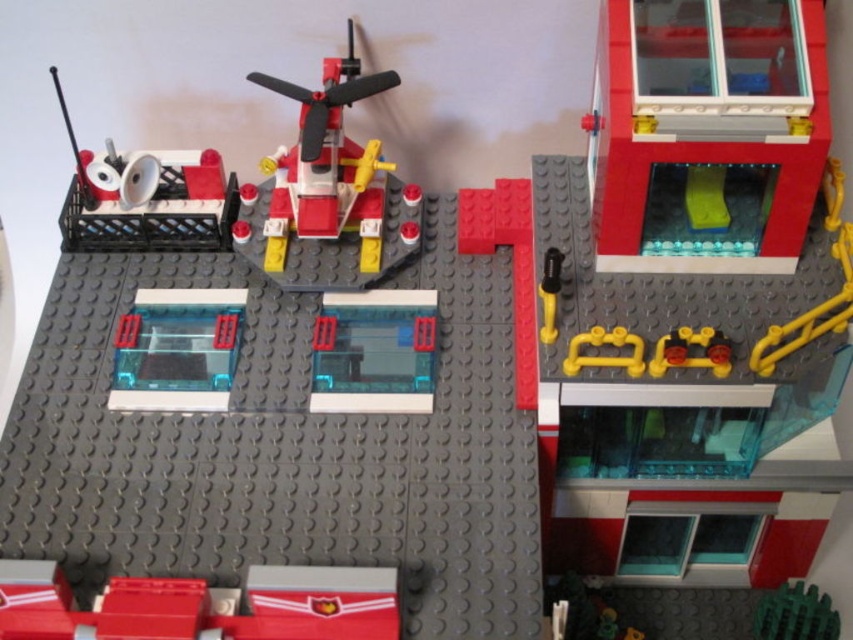
Does matte black speaker at upper left have a lesser width compared to transparent plastic window at center?

No, matte black speaker at upper left is not thinner than transparent plastic window at center.

Does point (109, 150) lie in front of point (425, 355)?

No.

Who is more distant from viewer, (180, 164) or (366, 307)?

Point (180, 164)

Locate an element on the screen. matte black speaker at upper left is located at coordinates (146, 196).

Between transparent plastic window at center and green rubber ball at lower right, which one has less height?

green rubber ball at lower right is shorter.

Is transparent plastic window at center above green rubber ball at lower right?

Yes, transparent plastic window at center is above green rubber ball at lower right.

Between point (404, 358) and point (804, 593), which one is positioned behind?

The point (804, 593) is behind.

Find the location of a particular element. transparent plastic window at center is located at coordinates (374, 352).

Is transparent plastic window at upper right taller than transparent plastic window at lower left?

Yes, transparent plastic window at upper right is taller than transparent plastic window at lower left.

The height and width of the screenshot is (640, 853). What do you see at coordinates (706, 122) in the screenshot?
I see `transparent plastic window at upper right` at bounding box center [706, 122].

Is point (770, 157) more distant than point (172, 289)?

No, it is in front of (172, 289).

Identify the location of transparent plastic window at upper right. The image size is (853, 640). (706, 122).